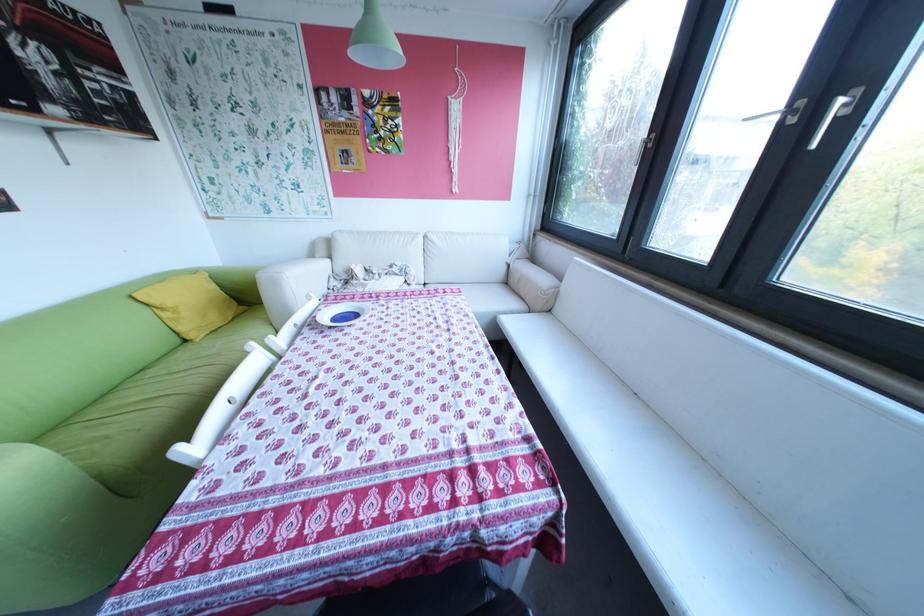
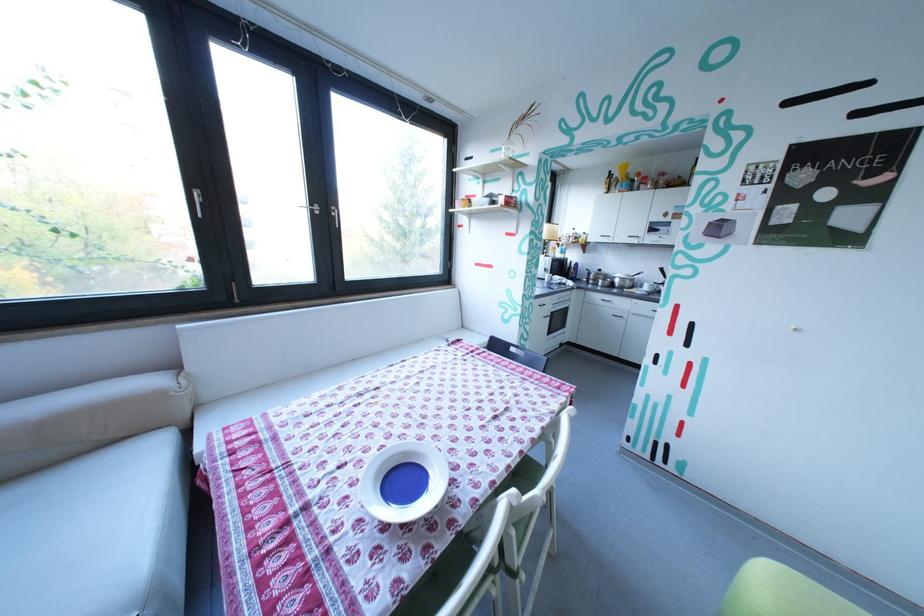
In the second image, find the point that corresponds to [805,120] in the first image.

(331, 213)